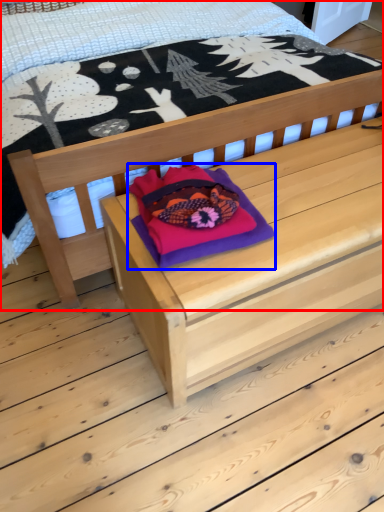
Question: Which point is further to the camera, bed (highlighted by a red box) or throw pillow (highlighted by a blue box)?

Choices:
 (A) bed
 (B) throw pillow

Answer: (B)